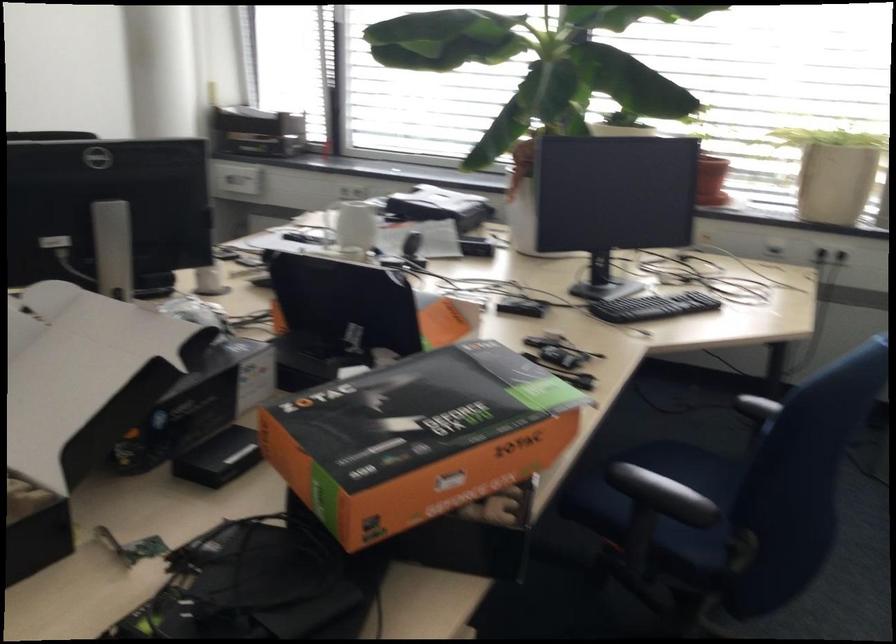
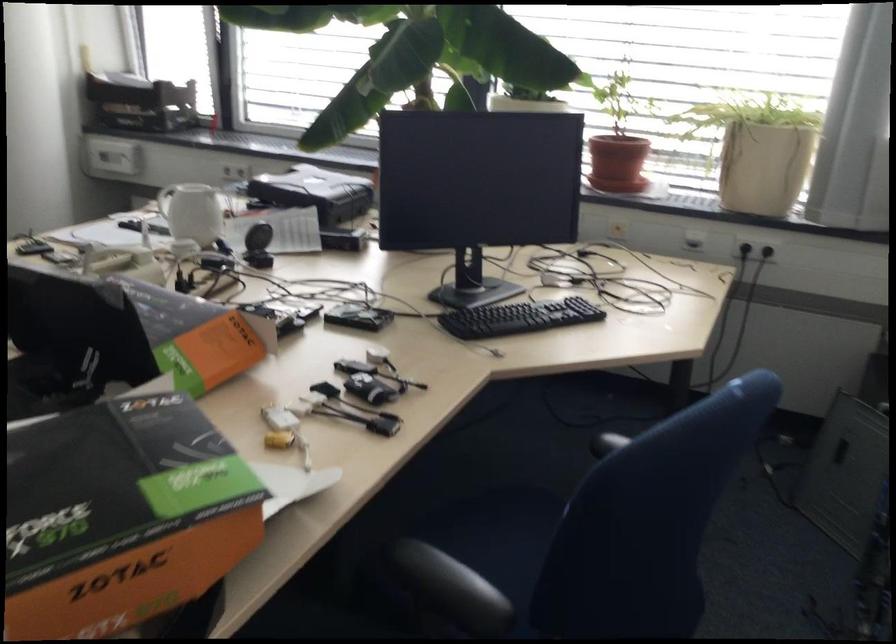
Locate, in the second image, the point that corresponds to (708,175) in the first image.

(616, 163)